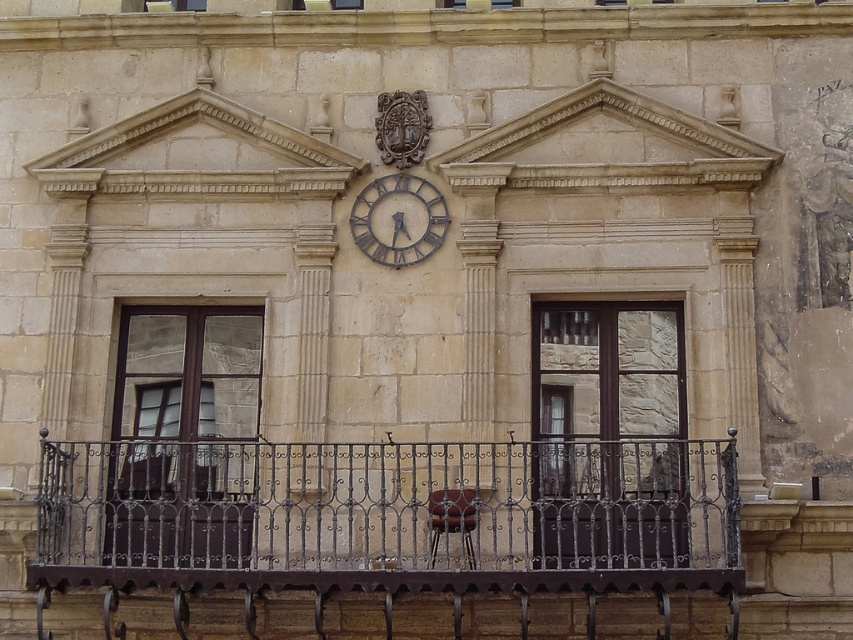
Question: Which object is closer to the camera taking this photo?

Choices:
 (A) rusty metal clock at center
 (B) dark brown wrought iron at center

Answer: (B)

Question: Which object appears farthest from the camera in this image?

Choices:
 (A) dark brown wrought iron at center
 (B) rusty metal clock at center

Answer: (B)

Question: In this image, where is dark brown wrought iron at center located relative to rusty metal clock at center?

Choices:
 (A) right
 (B) left

Answer: (B)

Question: From the image, what is the correct spatial relationship of dark brown wrought iron at center in relation to rusty metal clock at center?

Choices:
 (A) right
 (B) left

Answer: (B)

Question: In this image, where is dark brown wrought iron at center located relative to rusty metal clock at center?

Choices:
 (A) above
 (B) below

Answer: (B)